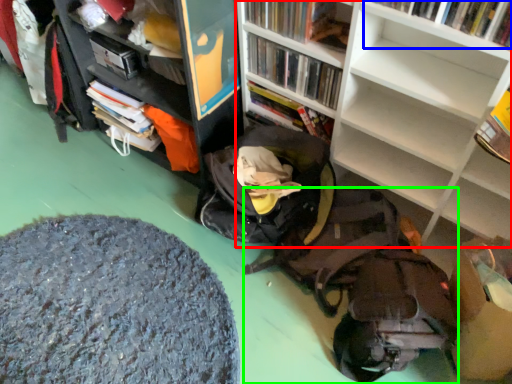
Question: Estimate the real-world distances between objects in this image. Which object is closer to bookcase (highlighted by a red box), book (highlighted by a blue box) or backpack (highlighted by a green box)?

Choices:
 (A) book
 (B) backpack

Answer: (A)